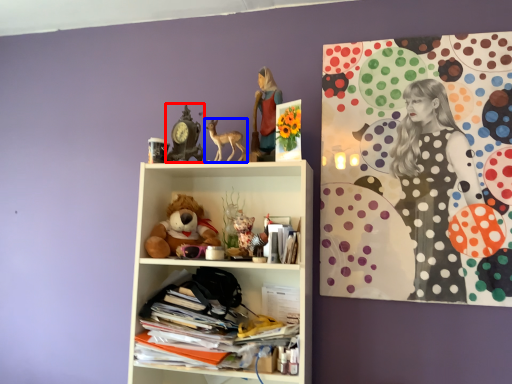
Question: Which object is further to the camera taking this photo, art (highlighted by a red box) or toy (highlighted by a blue box)?

Choices:
 (A) art
 (B) toy

Answer: (A)